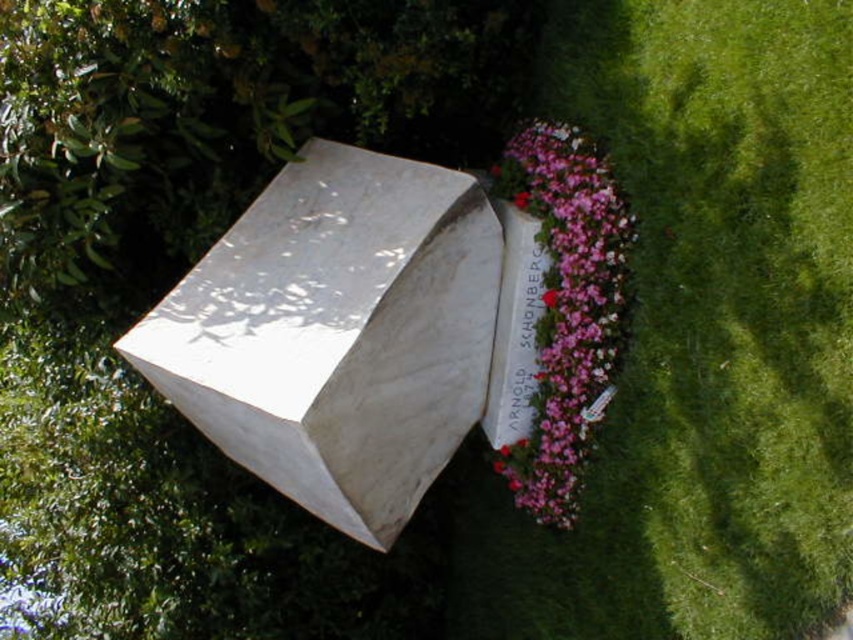
Does point (770, 54) come farther from viewer compared to point (440, 253)?

No, it is in front of (440, 253).

Locate an element on the screen. green grass at lower right is located at coordinates point(700,337).

Who is shorter, white marble box at center or pink floral bouquet at center?

pink floral bouquet at center

Based on the photo, is white marble box at center to the left of pink floral bouquet at center from the viewer's perspective?

Indeed, white marble box at center is positioned on the left side of pink floral bouquet at center.

This screenshot has width=853, height=640. In order to click on white marble box at center in this screenshot , I will do `click(337, 333)`.

Who is lower down, green grass at lower right or pink floral bouquet at center?

green grass at lower right is below.

Is green grass at lower right thinner than pink floral bouquet at center?

No.

Measure the distance between green grass at lower right and camera.

green grass at lower right is 3.01 meters away from camera.

The image size is (853, 640). Identify the location of green grass at lower right. (700, 337).